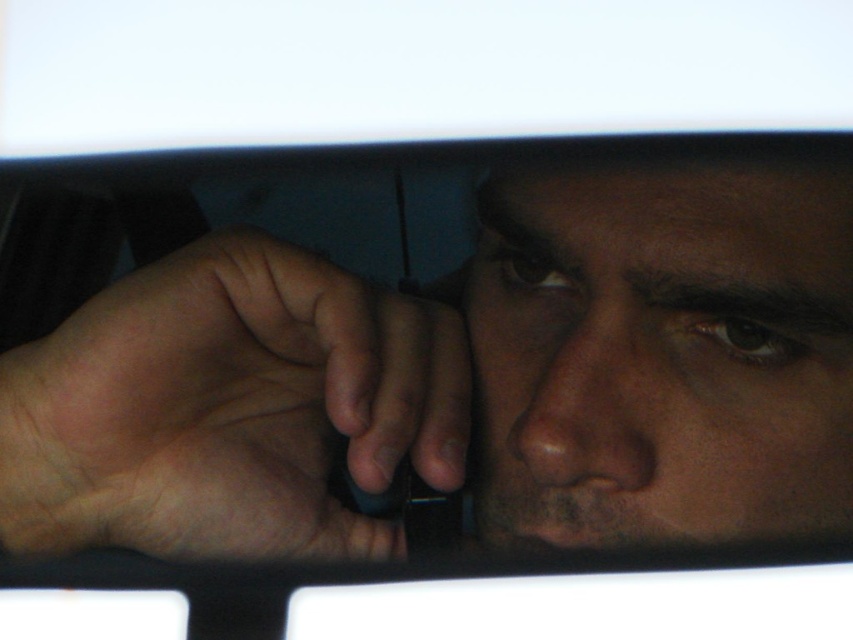
You are a photographer adjusting the lighting for a portrait. The subject has a dry skin nose at center and is holding a sleek black phone at lower left. You need to ensure that the phone doesn

The sleek black phone at lower left is 4.75 inches away from the dry skin nose at center. To avoid the phone casting a shadow on the nose, position the light source so it illuminates the nose while the phone is in shadow, or increase the distance between them.

You are a photographer adjusting your camera settings. You notice the matte black phone at center and the smooth skin face at center in your frame. Which object is nearer to your camera lens?

The matte black phone at center is closer to the viewer than the smooth skin face at center, so it is nearer to the camera lens.

You are a photographer adjusting the camera focus on your device. You need to ensure that the sleek black phone at lower left is in focus. Given its coordinates at point 0.641, 0.268, can you confirm if it falls within the camera focus area which is centered at 0.5, 0.5 with a radius of 0.2?

The sleek black phone at lower left is located at coordinates (228, 410). The distance from the center (426, 320) is sqrt of squared differences. Calculate sqrt of 0.141 squared plus 0.232 squared. That is sqrt of 0.019881 plus 0.053824 equals sqrt of 0.073705 which is approximately 0.2715. Since the focus radius is 0.2, the distance 0.2715 exceeds the radius. Therefore, the sleek black phone at lower left is outside the focus area.